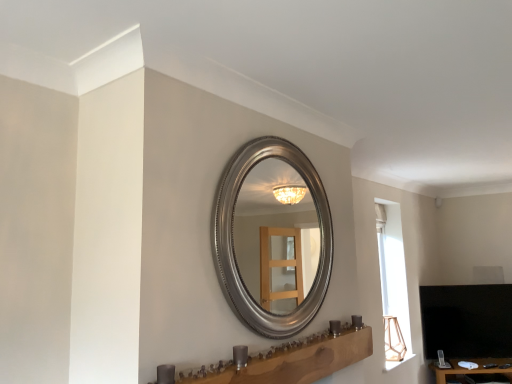
The image size is (512, 384). What do you see at coordinates (472, 369) in the screenshot?
I see `wooden table at lower right` at bounding box center [472, 369].

Identify the location of wooden table at lower right. Image resolution: width=512 pixels, height=384 pixels. (472, 369).

In order to face wooden table at lower right, should I rotate leftwards or rightwards?

Rotate your view right by about 27.525°.

What do you see at coordinates (291, 360) in the screenshot?
I see `wooden vanity at lower center` at bounding box center [291, 360].

Find the location of a particular element. wooden vanity at lower center is located at coordinates (291, 360).

Find the location of a particular element. The image size is (512, 384). wooden table at lower right is located at coordinates (472, 369).

Between wooden table at lower right and wooden vanity at lower center, which one appears on the left side from the viewer's perspective?

From the viewer's perspective, wooden vanity at lower center appears more on the left side.

Which object is further away from the camera, wooden table at lower right or wooden vanity at lower center?

wooden table at lower right.

Which is farther from the camera, (508, 361) or (307, 360)?

Point (508, 361)

From the image's perspective, is wooden table at lower right under wooden vanity at lower center?

Yes.

From a real-world perspective, is wooden table at lower right under wooden vanity at lower center?

Indeed, from a real-world perspective, wooden table at lower right is positioned beneath wooden vanity at lower center.

Is wooden table at lower right thinner than wooden vanity at lower center?

In fact, wooden table at lower right might be wider than wooden vanity at lower center.

Considering the relative sizes of wooden table at lower right and wooden vanity at lower center in the image provided, is wooden table at lower right shorter than wooden vanity at lower center?

No.

Based on the photo, considering the relative sizes of wooden table at lower right and wooden vanity at lower center in the image provided, is wooden table at lower right smaller than wooden vanity at lower center?

No.

Can wooden vanity at lower center be found inside wooden table at lower right?

No, wooden vanity at lower center is located outside of wooden table at lower right.

Is wooden table at lower right with wooden vanity at lower center?

They are not placed beside each other.

Is wooden table at lower right facing towards wooden vanity at lower center?

No, wooden table at lower right does not turn towards wooden vanity at lower center.

How different are the orientations of wooden table at lower right and wooden vanity at lower center in degrees?

wooden table at lower right and wooden vanity at lower center are facing 52.7 degrees away from each other.

You are a GUI agent. You are given a task and a screenshot of the screen. Output one action in this format:
    pyautogui.click(x=<x>, y=<y>)
    Task: Click on the table that appears on the right of wooden vanity at lower center
    This screenshot has width=512, height=384.
    Given the screenshot: What is the action you would take?
    pyautogui.click(x=472, y=369)

Would you say wooden vanity at lower center is to the left or to the right of wooden table at lower right in the picture?

wooden vanity at lower center is to the left of wooden table at lower right.

Is wooden vanity at lower center positioned before wooden table at lower right?

Yes, it is.

Does point (231, 376) appear closer or farther from the camera than point (438, 373)?

Point (231, 376) is positioned closer to the camera compared to point (438, 373).

From the image's perspective, which is above, wooden vanity at lower center or wooden table at lower right?

From the image's view, wooden vanity at lower center is above.

From a real-world perspective, who is located lower, wooden vanity at lower center or wooden table at lower right?

wooden table at lower right.

Considering the sizes of objects wooden vanity at lower center and wooden table at lower right in the image provided, who is wider, wooden vanity at lower center or wooden table at lower right?

Wider between the two is wooden table at lower right.

Considering the relative sizes of wooden vanity at lower center and wooden table at lower right in the image provided, is wooden vanity at lower center shorter than wooden table at lower right?

Indeed, wooden vanity at lower center has a lesser height compared to wooden table at lower right.

Consider the image. Between wooden vanity at lower center and wooden table at lower right, which one has larger size?

With larger size is wooden table at lower right.

Would you say wooden vanity at lower center contains wooden table at lower right?

Definitely not — wooden table at lower right is not inside wooden vanity at lower center.

Consider the image. Is wooden vanity at lower center directly adjacent to wooden table at lower right?

There is a gap between wooden vanity at lower center and wooden table at lower right.

Is wooden vanity at lower center oriented towards wooden table at lower right?

No, wooden vanity at lower center is not aimed at wooden table at lower right.

What's the angular difference between wooden vanity at lower center and wooden table at lower right's facing directions?

The angle between the facing direction of wooden vanity at lower center and the facing direction of wooden table at lower right is 52.7 degrees.

In order to click on vanity in front of the wooden table at lower right in this screenshot , I will do `click(291, 360)`.

You are a GUI agent. You are given a task and a screenshot of the screen. Output one action in this format:
    pyautogui.click(x=<x>, y=<y>)
    Task: Click on the table lying below the wooden vanity at lower center (from the image's perspective)
    This screenshot has width=512, height=384.
    Given the screenshot: What is the action you would take?
    click(472, 369)

Where is `table behind the wooden vanity at lower center`? This screenshot has width=512, height=384. table behind the wooden vanity at lower center is located at coordinates pyautogui.click(x=472, y=369).